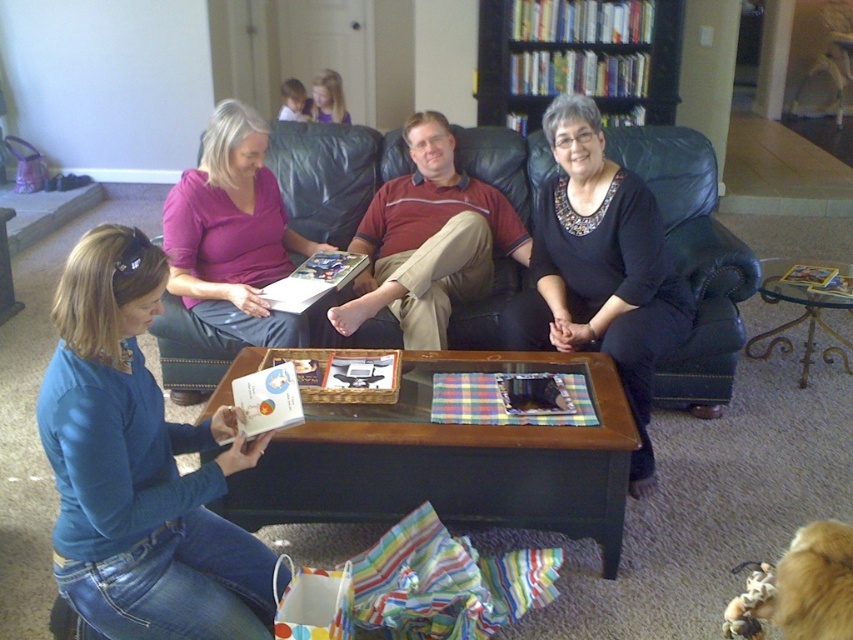
Question: Is leather couch at center to the right of black wood bookshelf at upper center from the viewer's perspective?

Choices:
 (A) yes
 (B) no

Answer: (A)

Question: Which of the following is the closest to the observer?

Choices:
 (A) (233, 225)
 (B) (474, 310)
 (C) (496, 93)
 (D) (114, 465)

Answer: (D)

Question: Considering the relative positions of leather couch at center and matte purple blouse at upper left in the image provided, where is leather couch at center located with respect to matte purple blouse at upper left?

Choices:
 (A) below
 (B) above

Answer: (B)

Question: Which of the following is the farthest from the observer?

Choices:
 (A) (294, 244)
 (B) (340, 129)
 (C) (167, 456)

Answer: (B)

Question: Does black matte dress at center come in front of black wood bookshelf at upper center?

Choices:
 (A) yes
 (B) no

Answer: (A)

Question: Which object is farther from the camera taking this photo?

Choices:
 (A) black wood bookshelf at upper center
 (B) matte purple blouse at upper left
 (C) leather couch at center

Answer: (A)